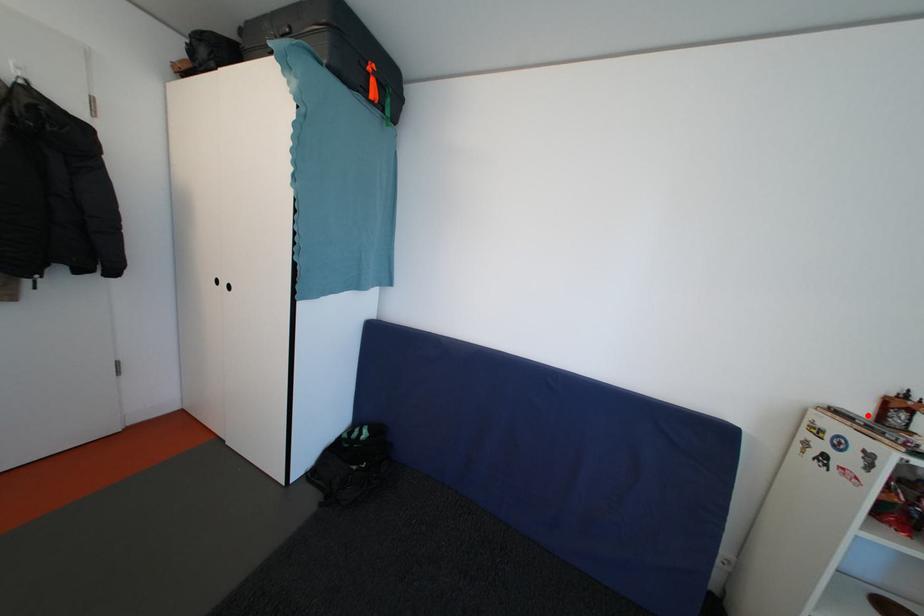
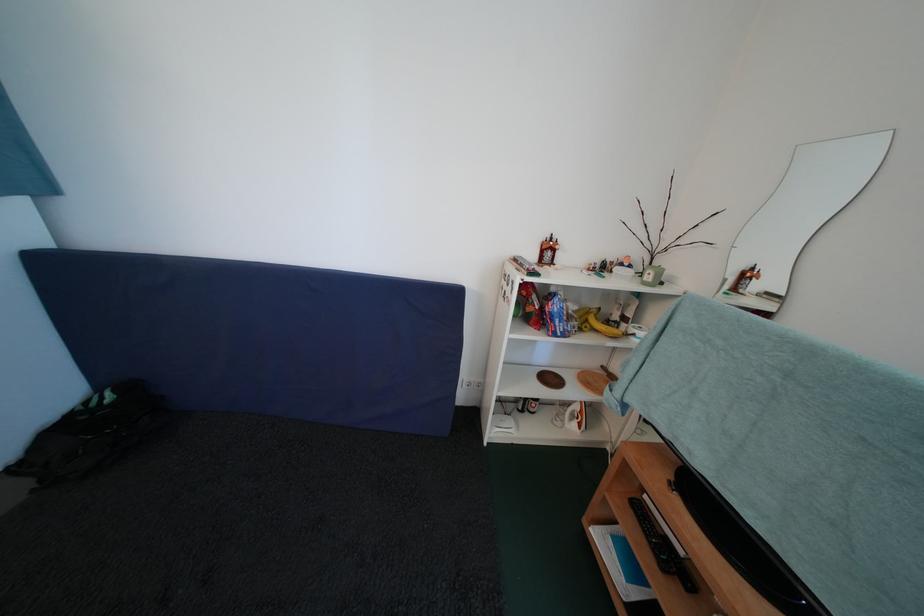
Locate, in the second image, the point that corresponds to the highlighted location in the first image.

(539, 261)